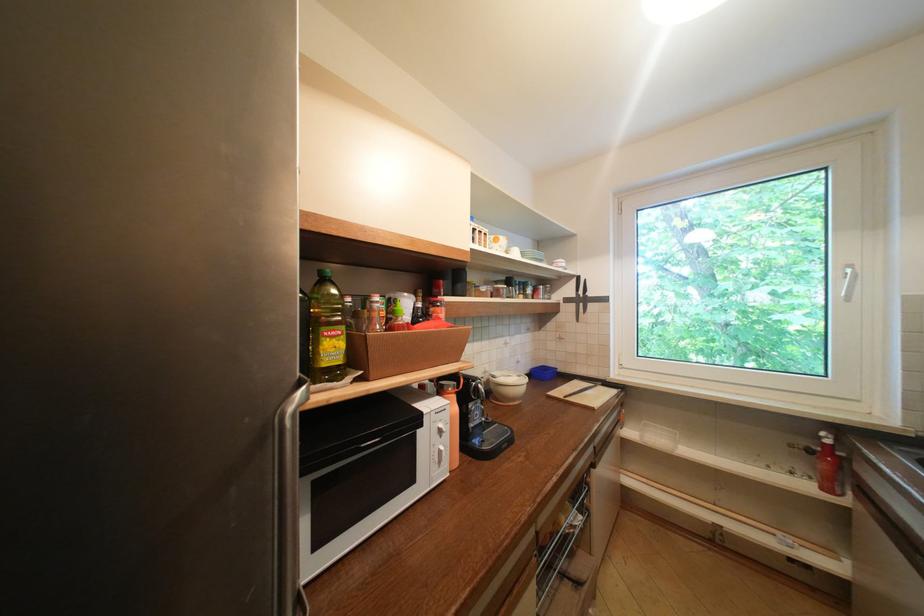
The height and width of the screenshot is (616, 924). Describe the element at coordinates (439, 446) in the screenshot. I see `a microwave door handle` at that location.